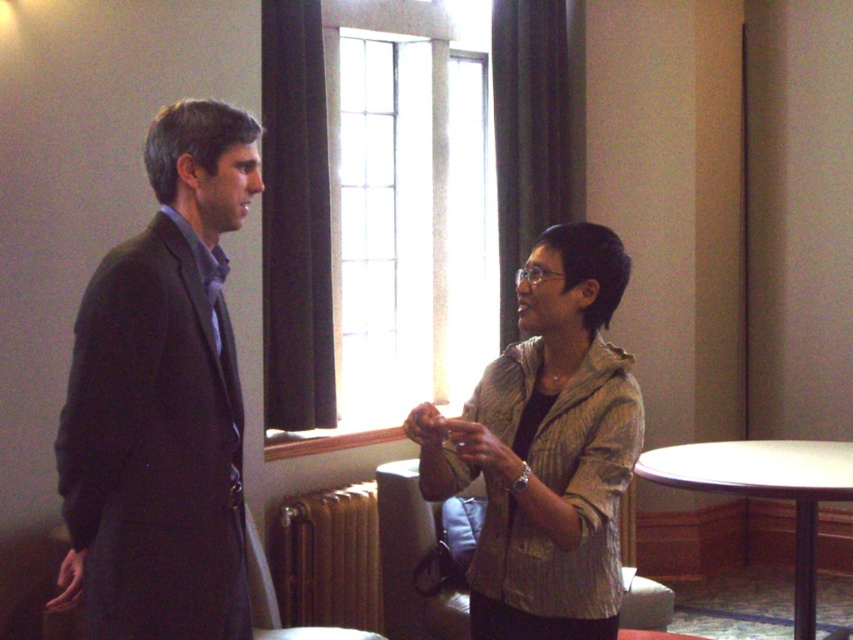
Measure the distance between point (120, 388) and camera.

Point (120, 388) and camera are 6.19 feet apart.

Which is above, dark gray suit at left or white wood table at lower right?

dark gray suit at left is above.

Which is behind, point (218, 260) or point (821, 464)?

Positioned behind is point (821, 464).

Identify the location of dark gray suit at left. (161, 401).

Between textured beige jacket at center and white wood table at lower right, which one appears on the right side from the viewer's perspective?

white wood table at lower right

Which is in front, point (437, 465) or point (694, 452)?

Point (437, 465) is more forward.

Locate an element on the screen. textured beige jacket at center is located at coordinates (546, 449).

Who is more distant from viewer, (219, 461) or (550, 506)?

The point (550, 506) is behind.

Does dark gray suit at left appear on the left side of textured beige jacket at center?

Correct, you'll find dark gray suit at left to the left of textured beige jacket at center.

Describe the element at coordinates (161, 401) in the screenshot. I see `dark gray suit at left` at that location.

I want to click on dark gray suit at left, so click(161, 401).